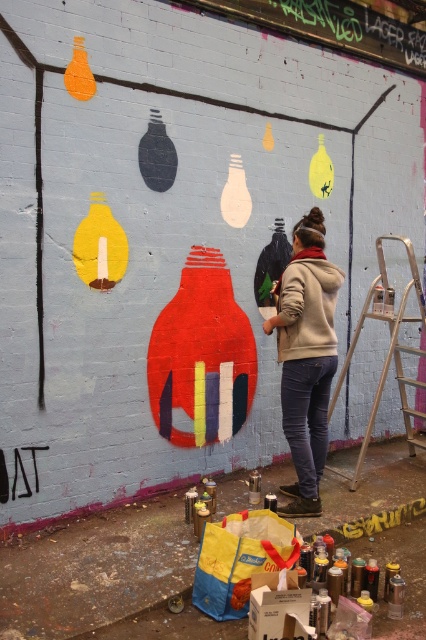
You are an art inspector checking the mural setup. You notice the beige fleece jacket at center and the metallic silver step ladder at right. Which object takes up more space in the scene?

The metallic silver step ladder at right takes up more space than the beige fleece jacket at center because the beige fleece jacket at center occupies less space than metallic silver step ladder at right.

You are an art student observing the artist and want to retrieve your beige fleece jacket at center. Where should you look relative to the metallic silver step ladder at right?

The beige fleece jacket at center is located below the metallic silver step ladder at right, so you should look downward from the ladder to find it.

You are an art inspector assessing the mural. You notice the beige fleece jacket at center and the metallic silver step ladder at right. Which object is taller?

The beige fleece jacket at center is much taller than the metallic silver step ladder at right.